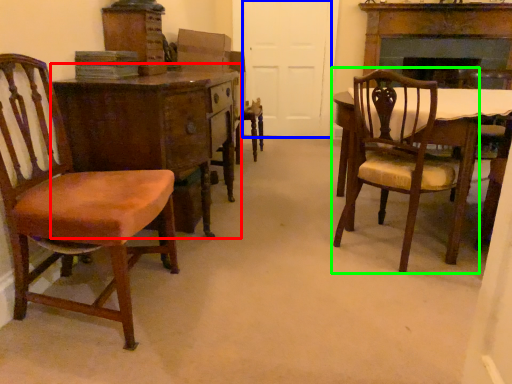
Question: Considering the real-world distances, which object is farthest from desk (highlighted by a red box)? door (highlighted by a blue box) or chair (highlighted by a green box)?

Choices:
 (A) door
 (B) chair

Answer: (A)